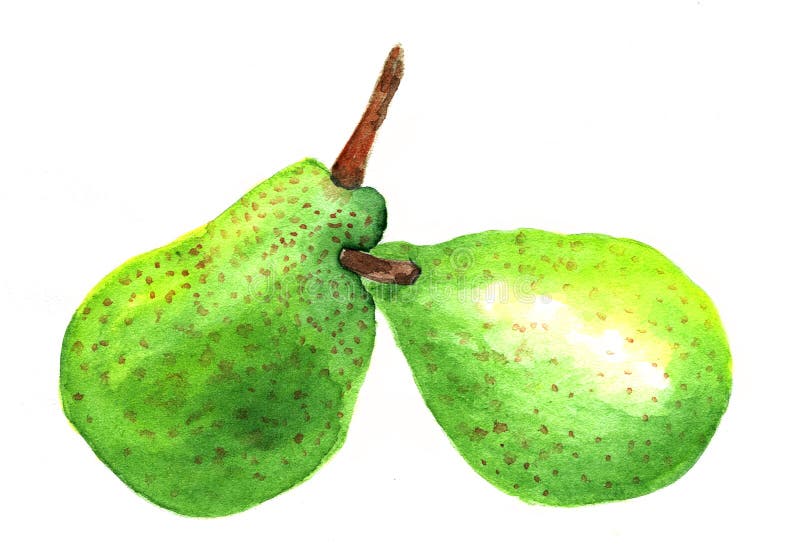
The height and width of the screenshot is (549, 800). Find the location of `artwork`. artwork is located at coordinates (374, 311).